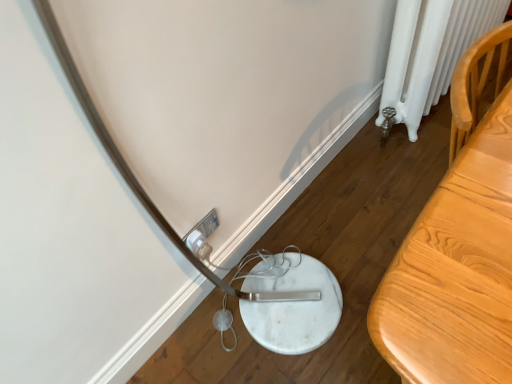
Question: From a real-world perspective, relative to white plastic electric outlet at lower center, is light wood table at right vertically above or below?

Choices:
 (A) below
 (B) above

Answer: (B)

Question: Is point (482, 203) positioned closer to the camera than point (190, 236)?

Choices:
 (A) closer
 (B) farther

Answer: (A)

Question: Considering the real-world distances, which object is farthest from the light wood table at right?

Choices:
 (A) white painted radiator at right
 (B) white plastic electric outlet at lower center

Answer: (B)

Question: Estimate the real-world distances between objects in this image. Which object is closer to the white plastic electric outlet at lower center?

Choices:
 (A) white painted radiator at right
 (B) light wood table at right

Answer: (B)